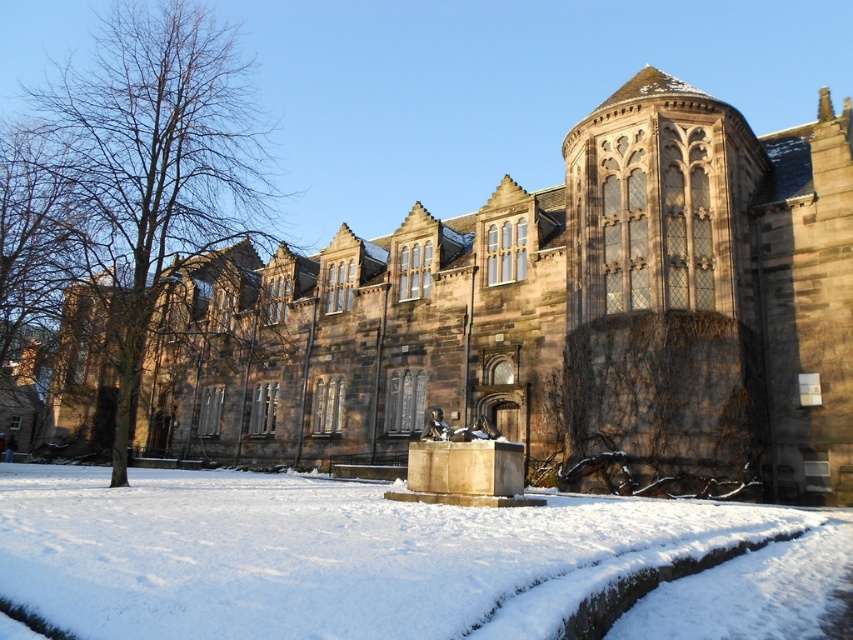
You are standing in front of the historic building and want to take a photo. You notice two points marked on the building. Which point is closer to your camera, point (7, 577) or point (184, 221)?

Point (7, 577) is closer to the camera than point (184, 221).

You are a visitor approaching the brown stone church at center and the white powdery snow at center. Which object is closer to you as you walk towards them?

The brown stone church at center is closer to you than the white powdery snow at center because it is positioned over it.